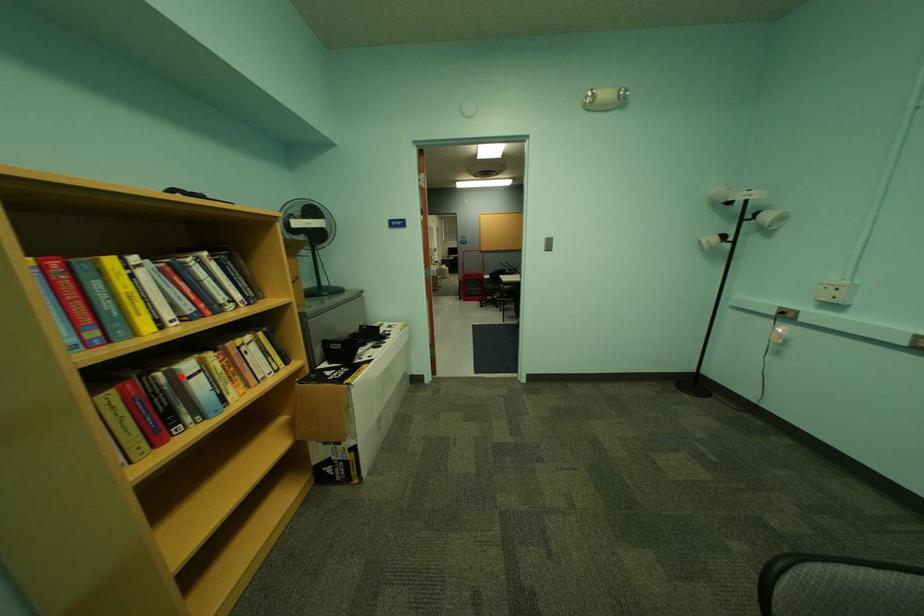
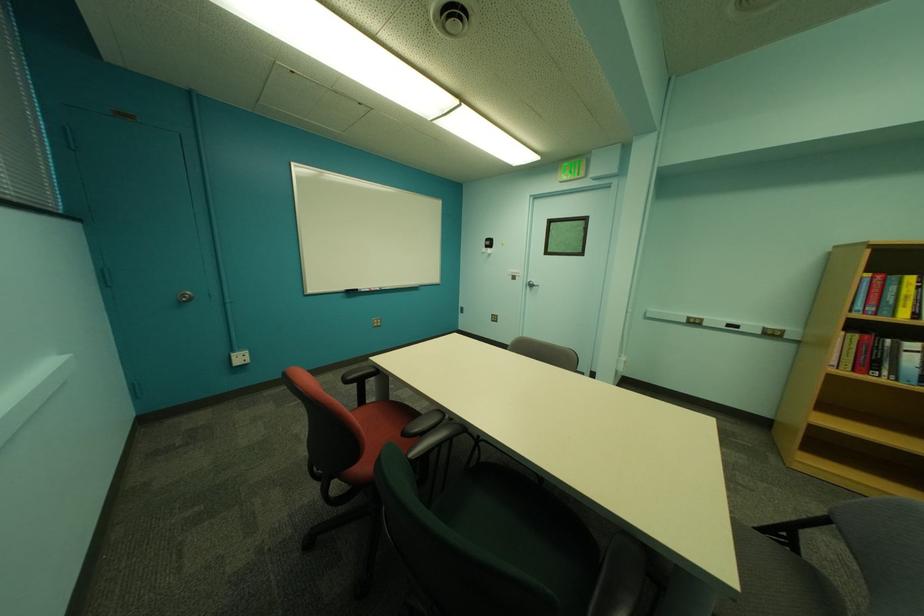
Find the pixel in the second image that matches the highlighted location in the first image.

(906, 346)